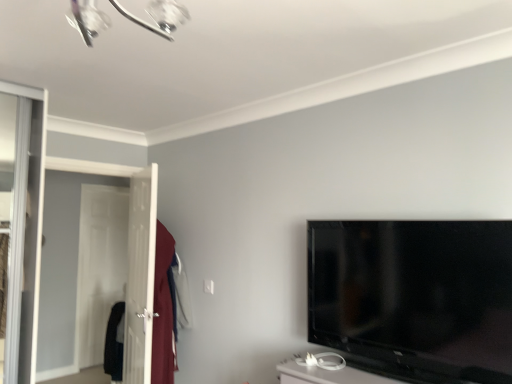
Question: Is white glossy screen door at left to the left or to the right of black glossy tv at right in the image?

Choices:
 (A) right
 (B) left

Answer: (B)

Question: Is white glossy screen door at left situated inside black glossy tv at right or outside?

Choices:
 (A) outside
 (B) inside

Answer: (A)

Question: Is point (140, 193) closer or farther from the camera than point (311, 231)?

Choices:
 (A) closer
 (B) farther

Answer: (B)

Question: Looking at the image, does black glossy tv at right seem bigger or smaller compared to white glossy screen door at left?

Choices:
 (A) small
 (B) big

Answer: (A)

Question: Based on their positions, is black glossy tv at right located to the left or right of white glossy screen door at left?

Choices:
 (A) left
 (B) right

Answer: (B)

Question: Would you say black glossy tv at right is inside or outside white glossy screen door at left?

Choices:
 (A) inside
 (B) outside

Answer: (B)

Question: Is black glossy tv at right wider or thinner than white glossy screen door at left?

Choices:
 (A) thin
 (B) wide

Answer: (A)